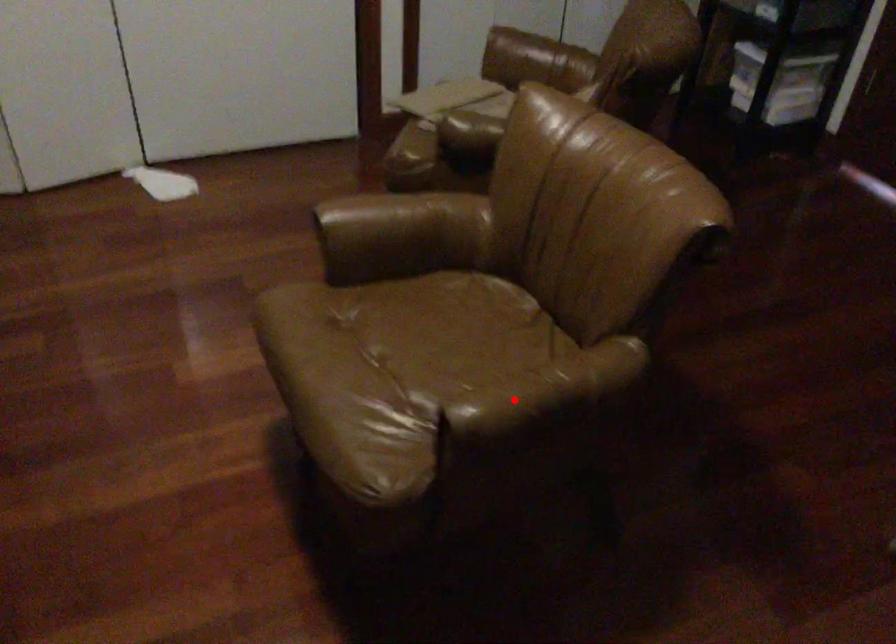
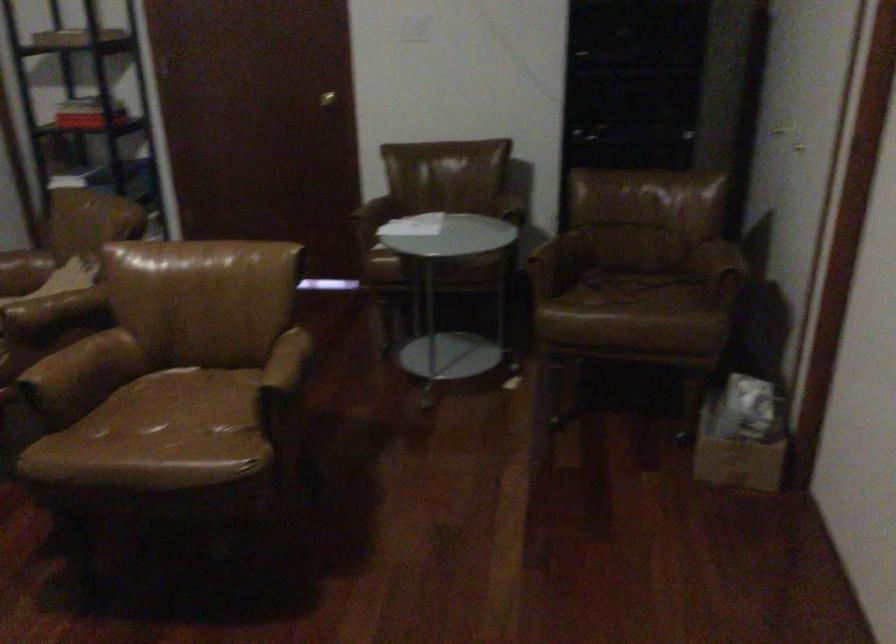
Question: I am providing you with two images of the same scene from different viewpoints. Image1 has a red point marked. In image2, the corresponding 3D location appears at what relative position? Reply with the corresponding letter.

Choices:
 (A) Closer
 (B) Farther

Answer: (B)